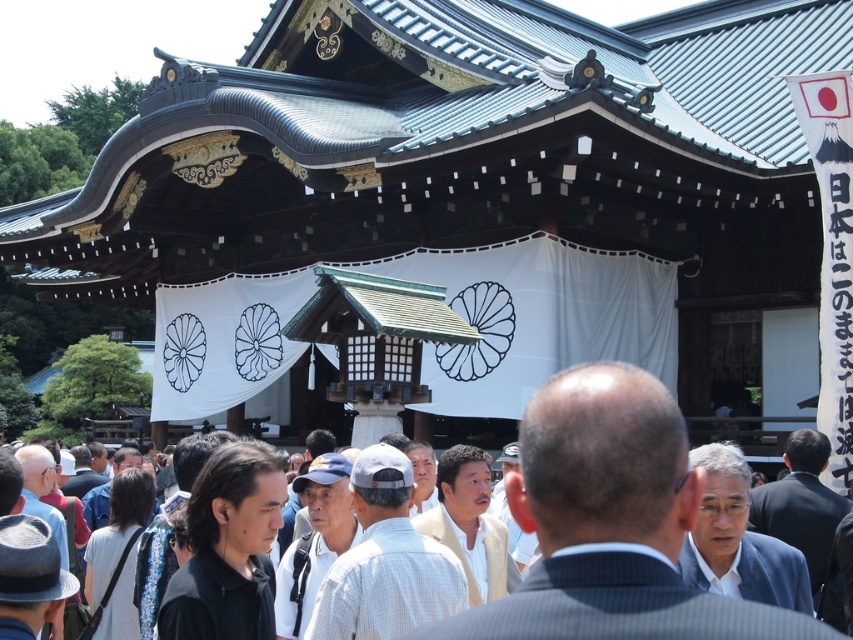
You are standing in front of the shrine and want to determine which of the two points, point (x=229, y=552) or point (x=136, y=540), is closer to you. Based on the scene description, which point is nearer?

Point (x=229, y=552) is closer to the viewer than point (x=136, y=540).